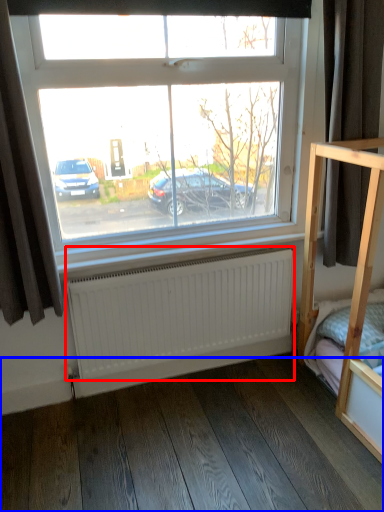
Question: Which object appears farthest to the camera in this image, radiator (highlighted by a red box) or hardwood (highlighted by a blue box)?

Choices:
 (A) radiator
 (B) hardwood

Answer: (A)